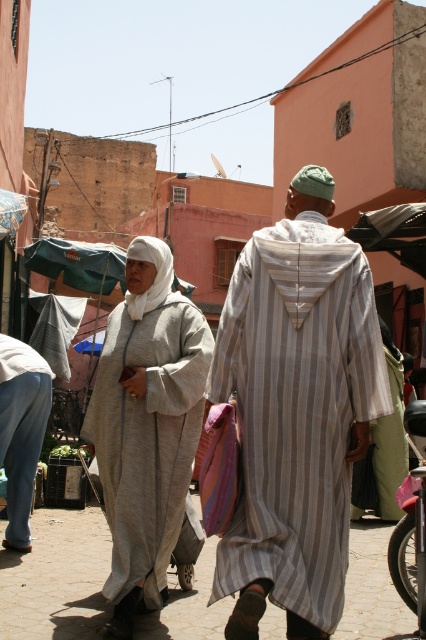
Question: Is striped cotton robe at center thinner than light gray woolen dress at center?

Choices:
 (A) no
 (B) yes

Answer: (A)

Question: Which point is farther to the camera?

Choices:
 (A) denim jeans at lower left
 (B) green striped robe at center
 (C) light gray woolen dress at center
 (D) striped cotton robe at center

Answer: (B)

Question: Is denim jeans at lower left in front of green striped robe at center?

Choices:
 (A) yes
 (B) no

Answer: (A)

Question: Can you confirm if denim jeans at lower left is thinner than green striped robe at center?

Choices:
 (A) yes
 (B) no

Answer: (A)

Question: Among these objects, which one is farthest from the camera?

Choices:
 (A) striped cotton robe at center
 (B) green striped robe at center
 (C) light gray woolen dress at center

Answer: (B)

Question: Which point is farther to the camera?

Choices:
 (A) light gray woolen dress at center
 (B) denim jeans at lower left
 (C) green striped robe at center

Answer: (C)